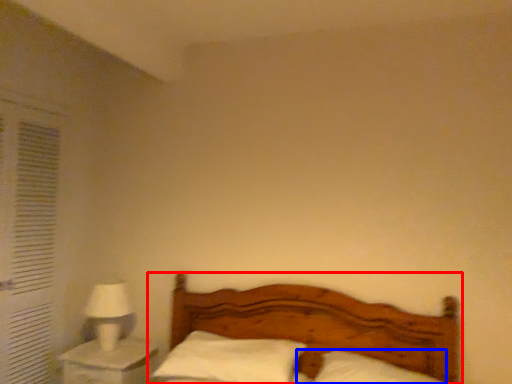
Question: Which object appears closest to the camera in this image, bed (highlighted by a red box) or pillow (highlighted by a blue box)?

Choices:
 (A) bed
 (B) pillow

Answer: (A)